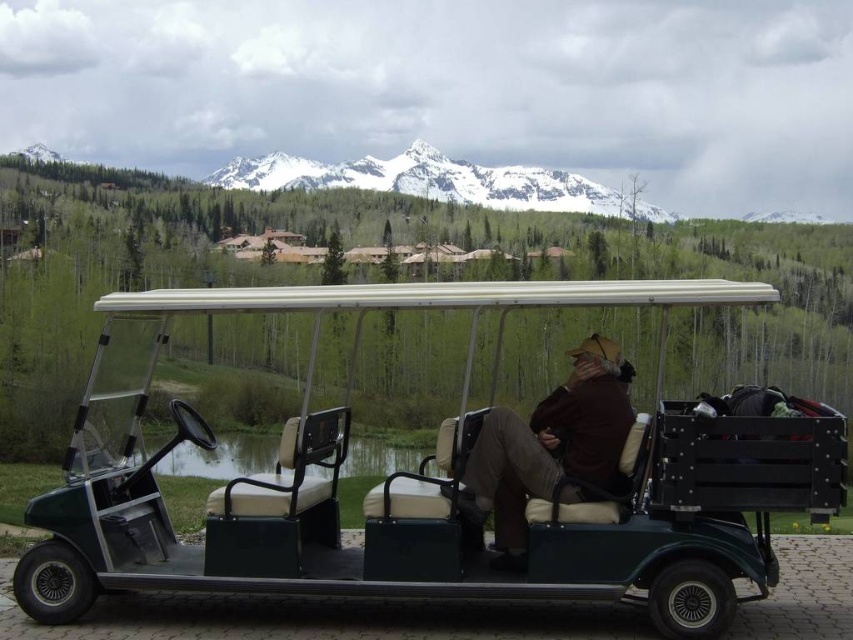
Does point (126, 564) come farther from viewer compared to point (558, 477)?

That is False.

Between green matte golf cart at center and brown leather jacket at center, which one is positioned higher?

Positioned higher is green matte golf cart at center.

Between point (759, 468) and point (508, 508), which one is positioned behind?

Positioned behind is point (508, 508).

Identify the location of green matte golf cart at center. (453, 477).

Who is more forward, (170,444) or (399,177)?

Point (170,444) is more forward.

Can you confirm if green matte golf cart at center is shorter than snowy peak at upper center?

Correct, green matte golf cart at center is not as tall as snowy peak at upper center.

Which is in front, point (635, 552) or point (322, 182)?

Point (635, 552) is in front.

The height and width of the screenshot is (640, 853). I want to click on green matte golf cart at center, so click(453, 477).

How distant is brown leather jacket at center from snowy peak at upper center?

268.82 meters

Is point (492, 496) behind point (537, 202)?

No, it is in front of (537, 202).

The width and height of the screenshot is (853, 640). In order to click on brown leather jacket at center in this screenshot , I will do 550,449.